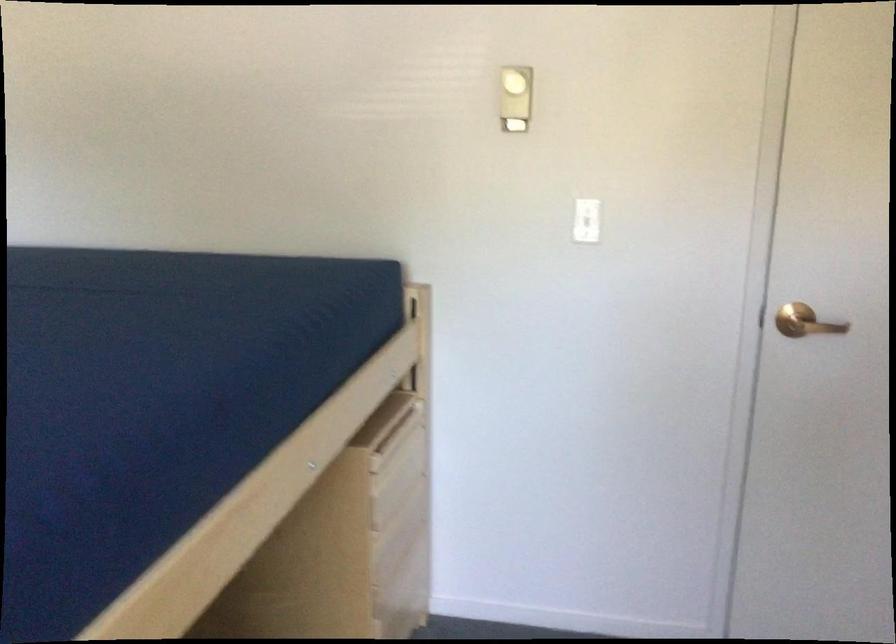
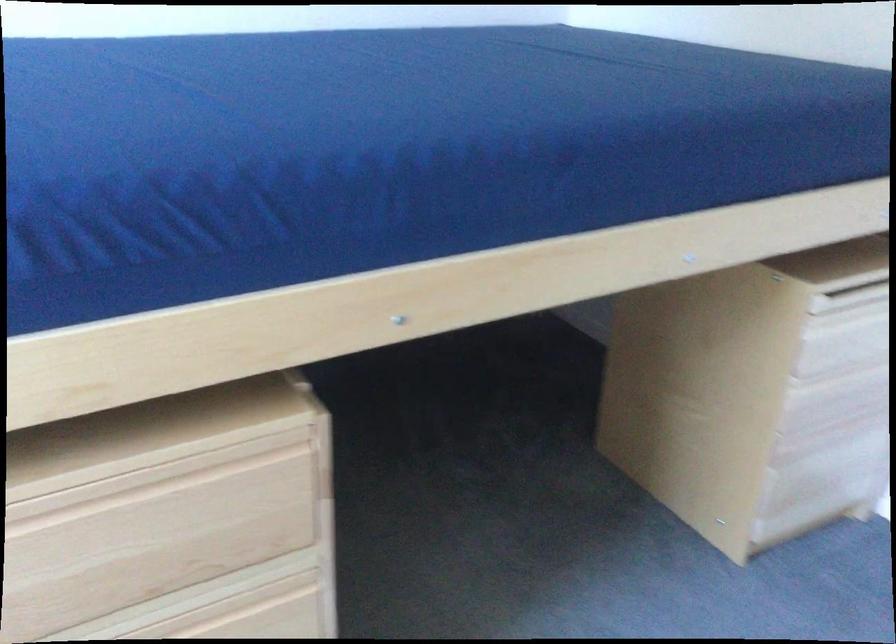
First-person continuous shooting, in which direction is the camera rotating?

The camera rotated toward left-down.